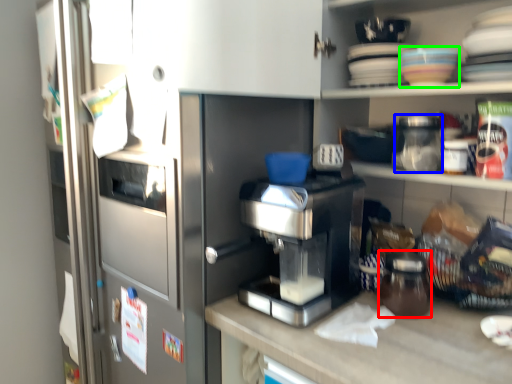
Question: Which object is the closest to the glass jar (highlighted by a red box)? Choose among these: glass jar (highlighted by a blue box) or tableware (highlighted by a green box).

Choices:
 (A) glass jar
 (B) tableware

Answer: (A)